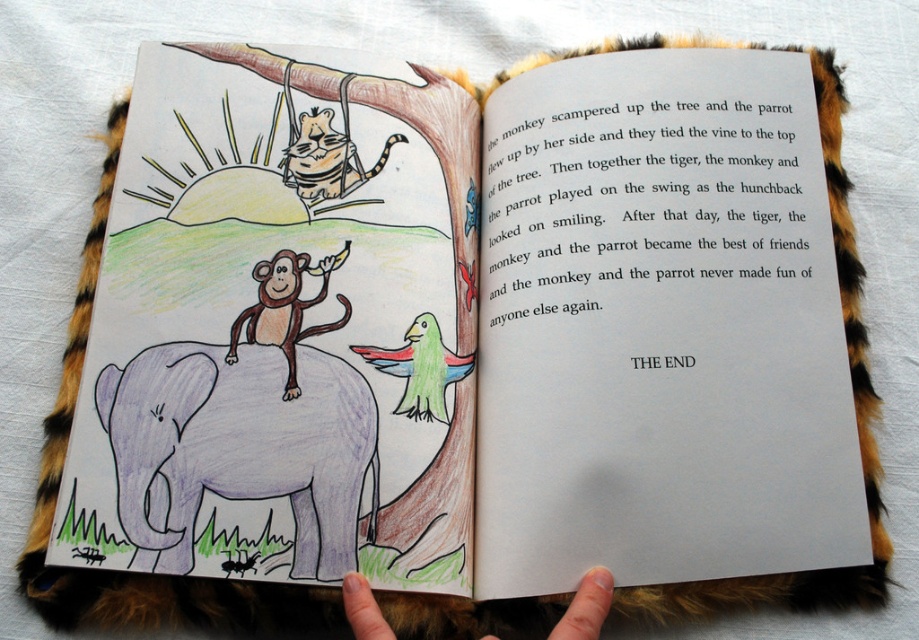
Question: Among these points, which one is farthest from the camera?

Choices:
 (A) (290, 333)
 (B) (222, 492)

Answer: (A)

Question: Does purple pastel elephant at lower left appear on the right side of fur at lower center?

Choices:
 (A) yes
 (B) no

Answer: (B)

Question: Among these points, which one is farthest from the camera?

Choices:
 (A) (271, 321)
 (B) (213, 424)
 (C) (577, 637)

Answer: (A)

Question: Is smooth brown monkey at center below fur at lower center?

Choices:
 (A) no
 (B) yes

Answer: (A)

Question: Which object is closer to the camera taking this photo?

Choices:
 (A) smooth brown monkey at center
 (B) fur at lower center

Answer: (B)

Question: Does purple pastel elephant at lower left have a greater width compared to smooth brown monkey at center?

Choices:
 (A) no
 (B) yes

Answer: (B)